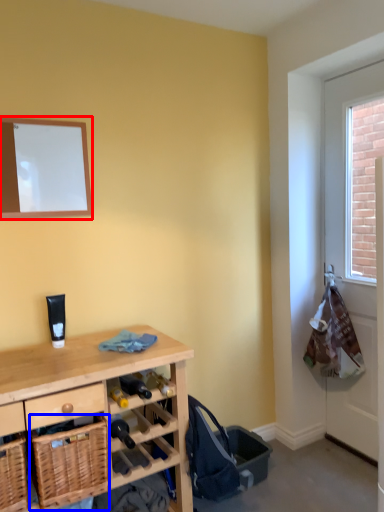
Question: Which point is closer to the camera, mirror (highlighted by a red box) or basket (highlighted by a blue box)?

Choices:
 (A) mirror
 (B) basket

Answer: (B)